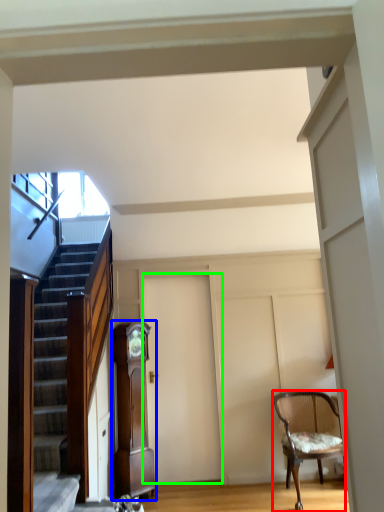
Question: Which is nearer to the chair (highlighted by a red box)? cabinetry (highlighted by a blue box) or door (highlighted by a green box).

Choices:
 (A) cabinetry
 (B) door

Answer: (B)